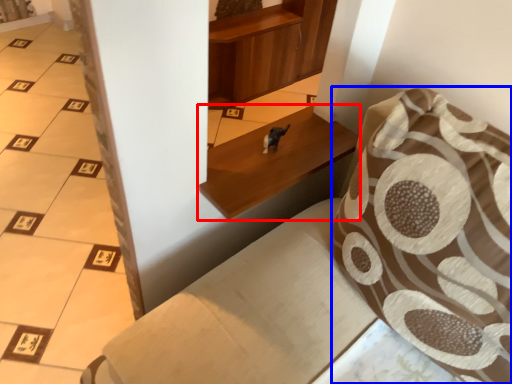
Question: Which object is further to the camera taking this photo, furniture (highlighted by a red box) or throw pillow (highlighted by a blue box)?

Choices:
 (A) furniture
 (B) throw pillow

Answer: (A)